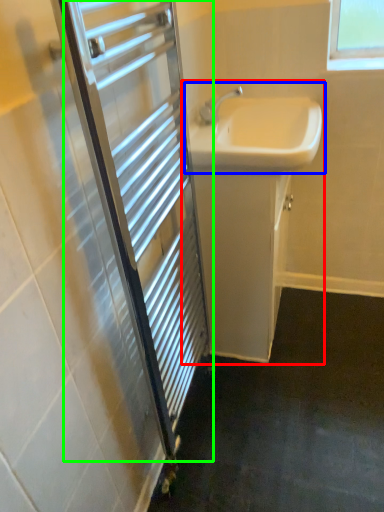
Question: Based on their relative distances, which object is nearer to bathroom cabinet (highlighted by a red box)? Choose from sink (highlighted by a blue box) and screen door (highlighted by a green box).

Choices:
 (A) sink
 (B) screen door

Answer: (A)